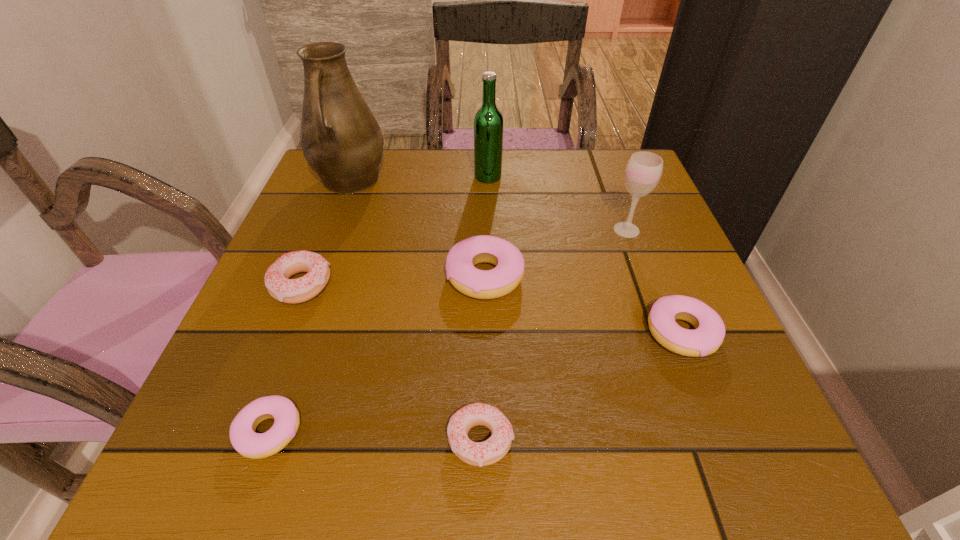
You are a GUI agent. You are given a task and a screenshot of the screen. Output one action in this format:
    pyautogui.click(x=<x>, y=<y>)
    Task: Click on the tallest object
    This screenshot has height=540, width=960.
    Given the screenshot: What is the action you would take?
    pyautogui.click(x=341, y=140)

Find the location of a particular element. The width and height of the screenshot is (960, 540). beer bottle is located at coordinates (488, 123).

At what (x,y) coordinates should I click in order to perform the action: click on the second tallest object. Please return your answer as a coordinate pair (x, y). Looking at the image, I should click on (488, 123).

Locate an element on the screen. The image size is (960, 540). wineglass is located at coordinates (643, 171).

In order to click on the third tallest object in this screenshot , I will do `click(643, 171)`.

Where is `the second pink doughnut from left to right`? Image resolution: width=960 pixels, height=540 pixels. the second pink doughnut from left to right is located at coordinates (482, 284).

Locate an element on the screen. This screenshot has height=540, width=960. the farthest pink doughnut is located at coordinates (482, 284).

This screenshot has height=540, width=960. I want to click on the bigger white doughnut, so click(x=292, y=291).

Image resolution: width=960 pixels, height=540 pixels. I want to click on the left white doughnut, so click(x=292, y=291).

Locate an element on the screen. the rightmost pink doughnut is located at coordinates (708, 335).